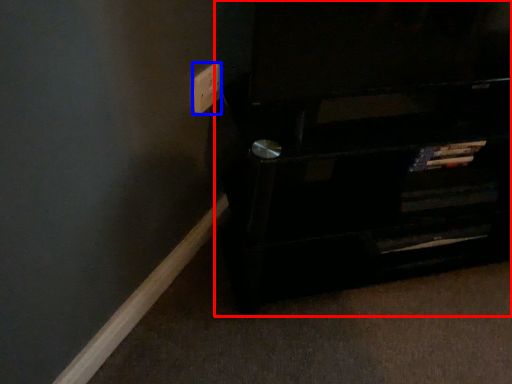
Question: Which object is further to the camera taking this photo, furniture (highlighted by a red box) or electric outlet (highlighted by a blue box)?

Choices:
 (A) furniture
 (B) electric outlet

Answer: (B)